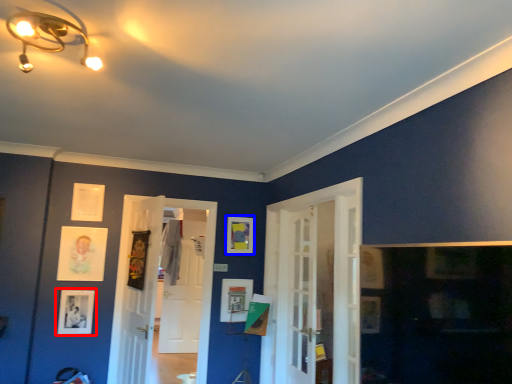
Question: Among these objects, which one is farthest to the camera, picture frame (highlighted by a red box) or picture frame (highlighted by a blue box)?

Choices:
 (A) picture frame
 (B) picture frame

Answer: (B)